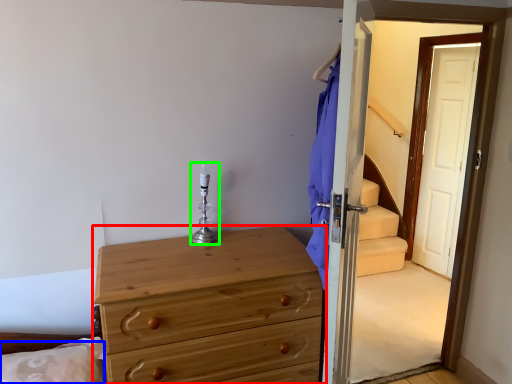
Question: Considering the real-world distances, which object is farthest from chest of drawers (highlighted by a red box)? pillow (highlighted by a blue box) or candle holder (highlighted by a green box)?

Choices:
 (A) pillow
 (B) candle holder

Answer: (A)